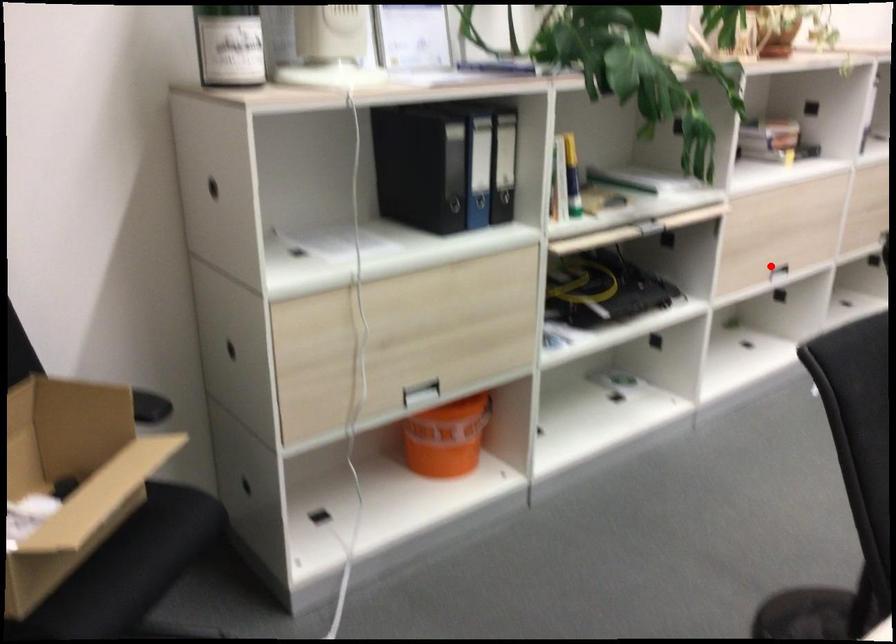
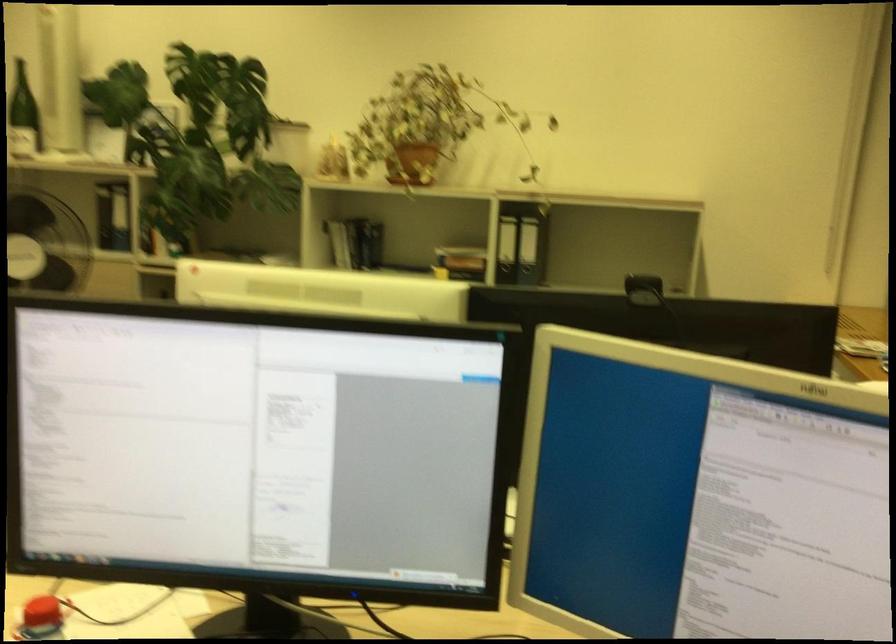
Question: I am providing you with two images of the same scene from different viewpoints. A red point is marked on the first image. Can you still see the location of the red point in image 2?

Choices:
 (A) Yes
 (B) No

Answer: (B)